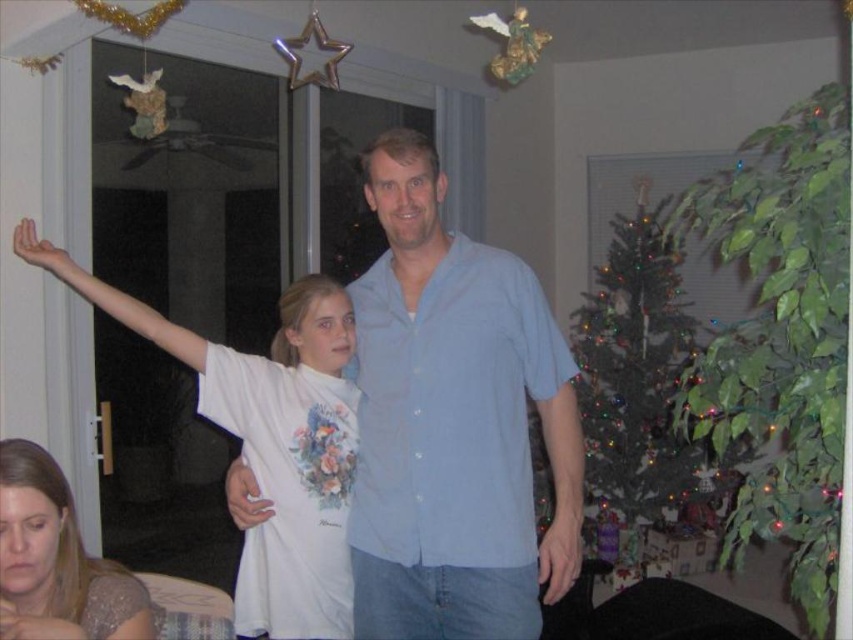
Question: Is light blue button-down shirt at center behind matte white shirt at lower left?

Choices:
 (A) no
 (B) yes

Answer: (B)

Question: Which is farther from the white cotton shirt at center?

Choices:
 (A) light blue button-down shirt at center
 (B) green matte christmas tree at right
 (C) matte white shirt at lower left

Answer: (B)

Question: Which of the following is the closest to the observer?

Choices:
 (A) (494, 371)
 (B) (300, 429)
 (C) (618, 518)

Answer: (A)

Question: Considering the relative positions of light blue button-down shirt at center and white cotton shirt at center in the image provided, where is light blue button-down shirt at center located with respect to white cotton shirt at center?

Choices:
 (A) left
 (B) right

Answer: (B)

Question: In this image, where is light blue button-down shirt at center located relative to white cotton shirt at center?

Choices:
 (A) below
 (B) above

Answer: (A)

Question: Estimate the real-world distances between objects in this image. Which object is closer to the light blue button-down shirt at center?

Choices:
 (A) matte white shirt at lower left
 (B) white cotton shirt at center
 (C) green matte christmas tree at right

Answer: (B)